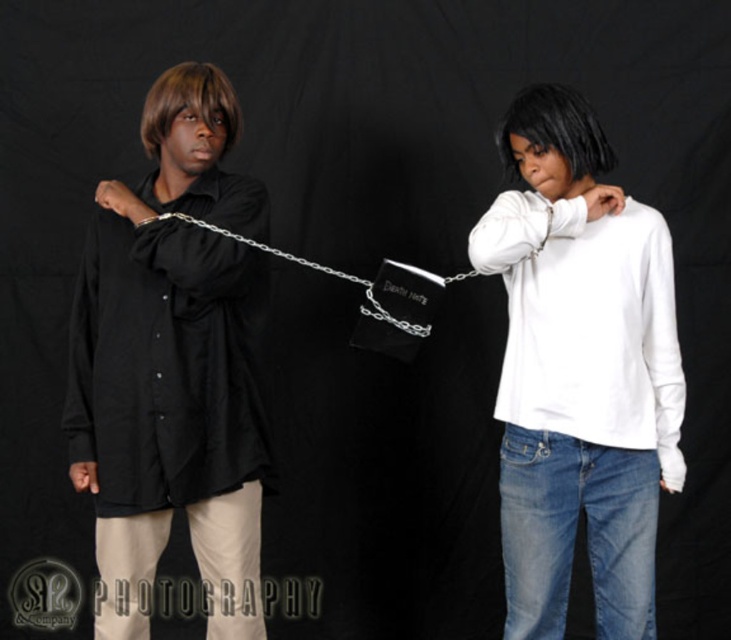
Question: In this image, where is black matte shirt at left located relative to white matte shirt at center?

Choices:
 (A) below
 (B) above

Answer: (B)

Question: Which point appears closest to the camera in this image?

Choices:
 (A) (556, 371)
 (B) (137, 387)

Answer: (A)

Question: Which object is farther from the camera taking this photo?

Choices:
 (A) white matte shirt at center
 (B) metallic silver chain at center
 (C) black matte shirt at left

Answer: (B)

Question: Is black matte shirt at left thinner than white matte shirt at center?

Choices:
 (A) yes
 (B) no

Answer: (A)

Question: Can you confirm if black matte shirt at left is positioned below metallic silver chain at center?

Choices:
 (A) no
 (B) yes

Answer: (B)

Question: Which of the following is the farthest from the observer?

Choices:
 (A) (213, 177)
 (B) (648, 365)

Answer: (A)